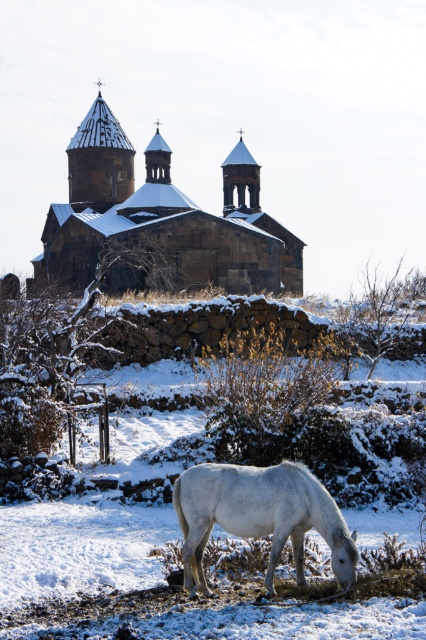
You are standing at the origin point in the image. Which direction should you move to reach the dark brown stone church at center?

The dark brown stone church at center is located at coordinates 0.348 in the x direction and 0.376 in the y direction. Since you are at the origin point, you should move in the positive x and positive y directions to reach it.

You are an architect analyzing the spatial relationship between the dark brown stone church at center and the white matte horse at lower center. Based on the scene description, which object is located higher in the image?

The dark brown stone church at center is positioned over the white matte horse at lower center, so it is higher in the image.